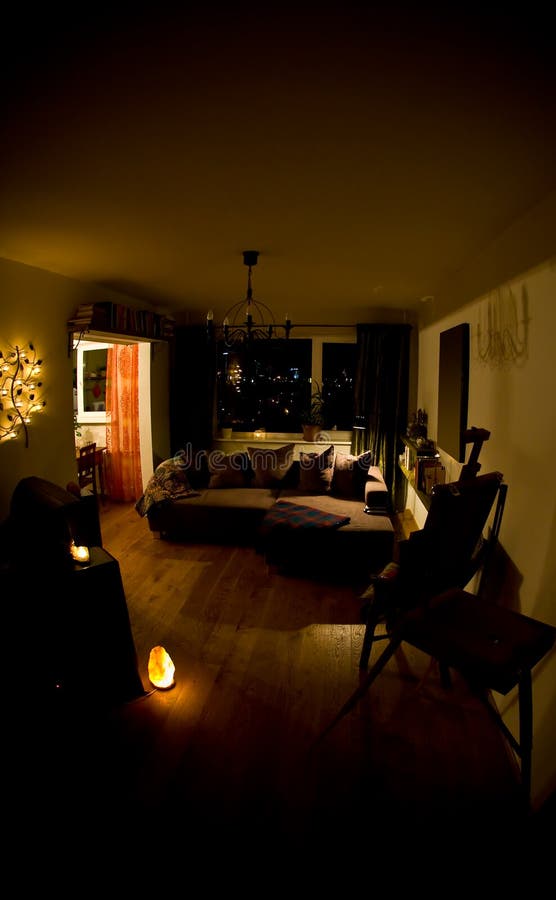
Where is `couch`? The height and width of the screenshot is (900, 556). couch is located at coordinates (314, 496).